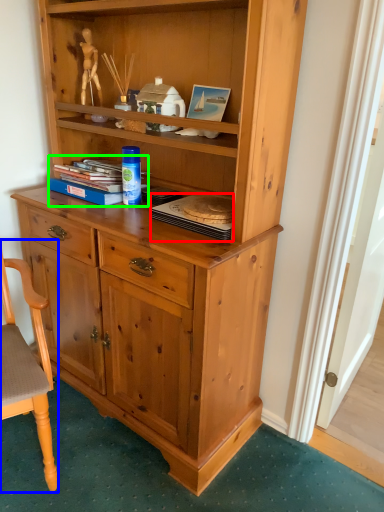
Question: Based on their relative distances, which object is farther from book (highlighted by a red box)? Choose from chair (highlighted by a blue box) and book (highlighted by a green box).

Choices:
 (A) chair
 (B) book

Answer: (A)